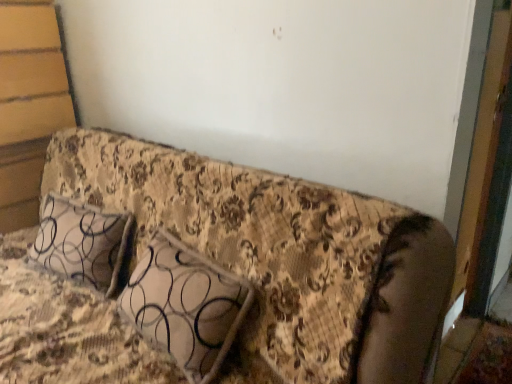
Question: Looking at their shapes, would you say patterned fabric pillow at center is wider or thinner than floral fabric couch at center?

Choices:
 (A) thin
 (B) wide

Answer: (A)

Question: Looking at the image, does patterned fabric pillow at center seem bigger or smaller compared to floral fabric couch at center?

Choices:
 (A) small
 (B) big

Answer: (A)

Question: Would you say patterned fabric pillow at center is inside or outside floral fabric couch at center?

Choices:
 (A) outside
 (B) inside

Answer: (B)

Question: Is floral fabric couch at center situated inside patterned fabric pillow at center or outside?

Choices:
 (A) outside
 (B) inside

Answer: (A)

Question: From the image's perspective, is floral fabric couch at center above or below patterned fabric pillow at center?

Choices:
 (A) below
 (B) above

Answer: (A)

Question: From their relative heights in the image, would you say floral fabric couch at center is taller or shorter than patterned fabric pillow at center?

Choices:
 (A) tall
 (B) short

Answer: (A)

Question: Is point (110, 190) closer or farther from the camera than point (218, 292)?

Choices:
 (A) closer
 (B) farther

Answer: (B)